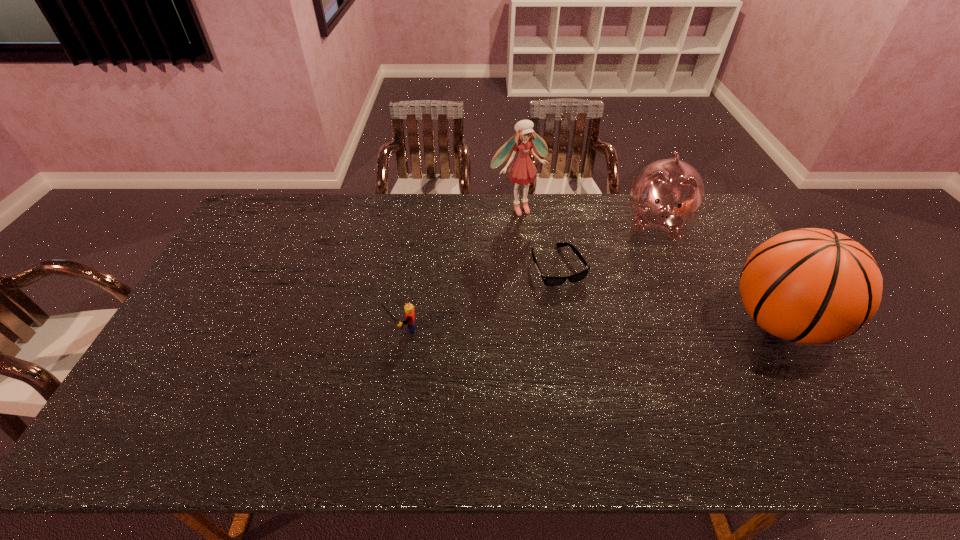
At what (x,y) coordinates should I click in order to perform the action: click on vacant region between the piggy bank and the basketball. Please return your answer as a coordinate pair (x, y). This screenshot has width=960, height=540. Looking at the image, I should click on (718, 273).

Locate an element on the screen. free space that is in between the basketball and the doll is located at coordinates (648, 265).

The image size is (960, 540). In order to click on empty location between the shortest object and the basketball in this screenshot , I will do `click(669, 294)`.

I want to click on vacant space that is in between the basketball and the piggy bank, so click(x=718, y=273).

Find the location of a particular element. Image resolution: width=960 pixels, height=540 pixels. free spot between the leftmost object and the shortest object is located at coordinates (480, 297).

You are a GUI agent. You are given a task and a screenshot of the screen. Output one action in this format:
    pyautogui.click(x=<x>, y=<y>)
    Task: Click on the free space between the piggy bank and the sunglasses
    
    Given the screenshot: What is the action you would take?
    pyautogui.click(x=608, y=245)

You are a GUI agent. You are given a task and a screenshot of the screen. Output one action in this format:
    pyautogui.click(x=<x>, y=<y>)
    Task: Click on the free spot between the shortest object and the piggy bank
    The width and height of the screenshot is (960, 540).
    Given the screenshot: What is the action you would take?
    pyautogui.click(x=608, y=245)

Identify the location of vacant space that's between the leftmost object and the sunglasses. point(480,297).

What are the coordinates of `free space between the piggy bank and the fourth tallest object` in the screenshot? It's located at (530, 276).

This screenshot has height=540, width=960. I want to click on vacant region between the shortest object and the doll, so click(538, 237).